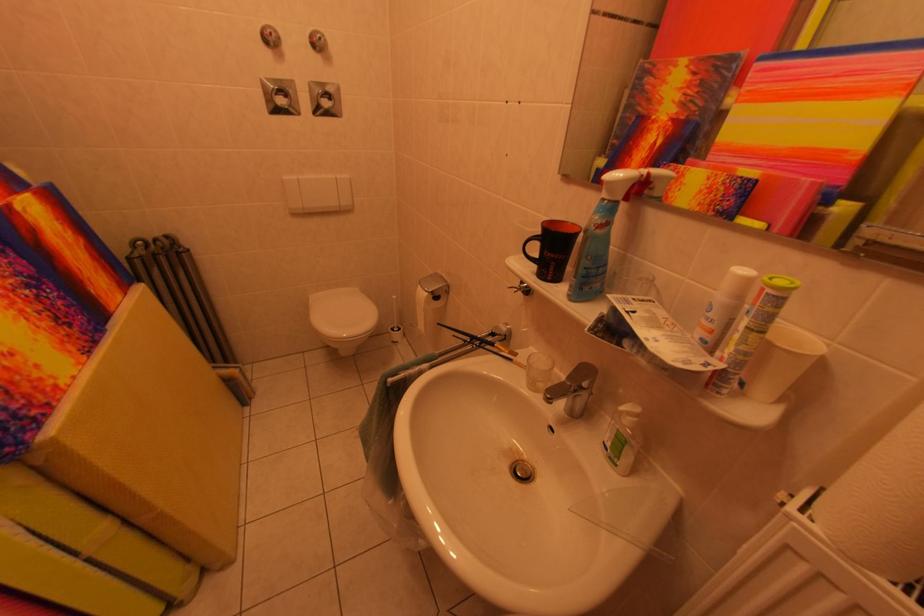
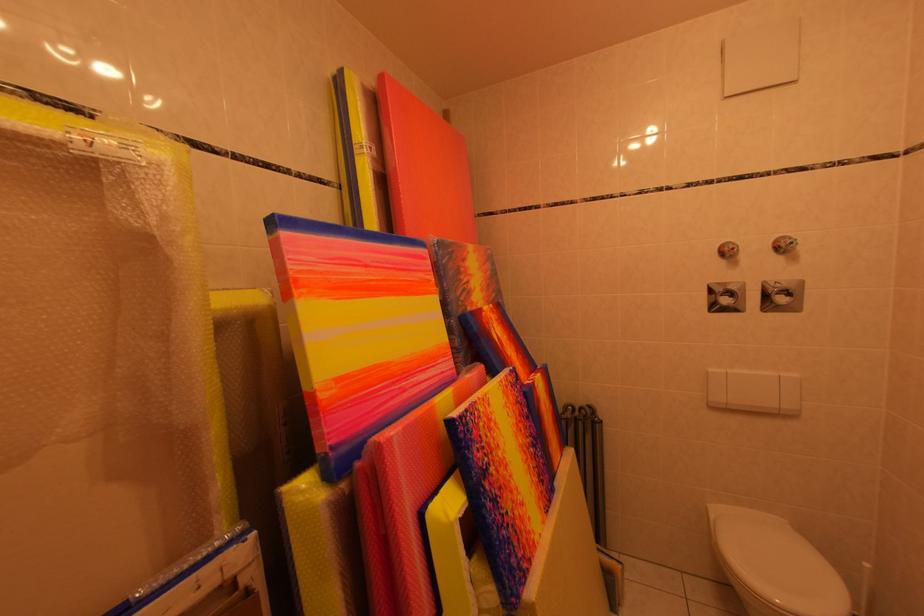
The images are taken continuously from a first-person perspective. In which direction is your viewpoint rotating?

The camera rotated toward left-up.